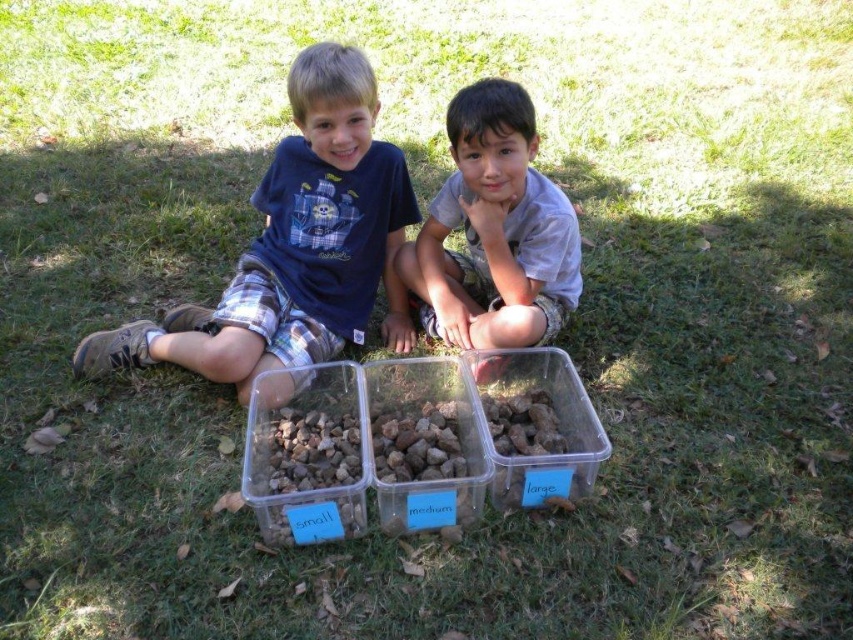
You are a photographer standing at the camera position. You want to take a photo of the two boys. The focus point of your camera is set to point (515, 316). Is the focus point closer to the boy on the left or the boy on the right?

The focus point at (515, 316) is 7.21 feet away from the camera. Since this distance is the same for both boys, the focus point is equidistant to both boys. However, the description does not specify their exact positions relative to the point, so we cannot determine which boy it is closer to based on the given information.

You are a photographer trying to capture the matte blue shirt at center and the translucent plastic container at center in the same frame. Which object should you focus on first to ensure both are in focus?

The matte blue shirt at center is above the translucent plastic container at center, so you should focus on the translucent plastic container at center first to ensure both are in focus since it is closer to the camera.

You are a photographer trying to capture a closeup of the translucent plastic container at center. The gray cotton shirt at center is blocking your view. Can you move the shirt to the side to get a clear shot?

The translucent plastic container at center is behind the gray cotton shirt at center, so you can move the gray cotton shirt at center to the side to get a clear shot of the translucent plastic container at center.